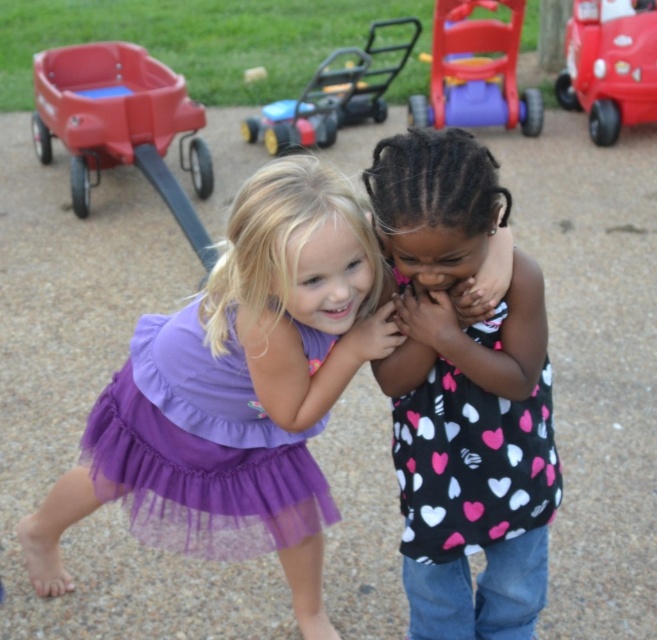
Question: Does black heart-patterned shirt at center have a smaller size compared to rubberized plastic walker at upper center?

Choices:
 (A) yes
 (B) no

Answer: (A)

Question: In this image, where is matte plastic wagon at upper left located relative to smooth plastic car at upper right?

Choices:
 (A) left
 (B) right

Answer: (A)

Question: Can you confirm if black heart-patterned shirt at center is smaller than smooth plastic car at upper right?

Choices:
 (A) no
 (B) yes

Answer: (B)

Question: Among these objects, which one is nearest to the camera?

Choices:
 (A) black heart-patterned shirt at center
 (B) matte purple dress at center
 (C) black dotted shirt at center

Answer: (A)

Question: Which point is closer to the camera?

Choices:
 (A) matte plastic toy car at center
 (B) purple tulle skirt at center
 (C) black polka dot tank top at center

Answer: (B)

Question: Which point is farther from the camera taking this photo?

Choices:
 (A) (342, 52)
 (B) (204, 333)

Answer: (A)